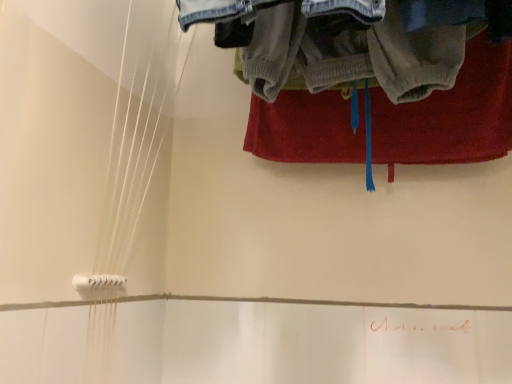
The image size is (512, 384). What are the coordinates of `red fabric towel at upper center` in the screenshot? It's located at (450, 115).

This screenshot has width=512, height=384. What do you see at coordinates (450, 115) in the screenshot?
I see `red fabric towel at upper center` at bounding box center [450, 115].

I want to click on red fabric towel at upper center, so click(450, 115).